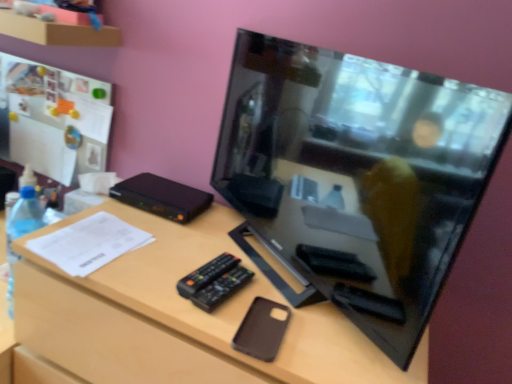
This screenshot has width=512, height=384. I want to click on free space behind black plastic remote at center, so click(221, 242).